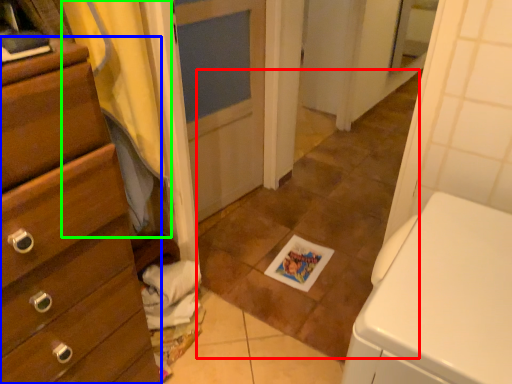
Question: Considering the real-world distances, which object is closest to tile (highlighted by a red box)? chest of drawers (highlighted by a blue box) or curtain (highlighted by a green box).

Choices:
 (A) chest of drawers
 (B) curtain

Answer: (B)